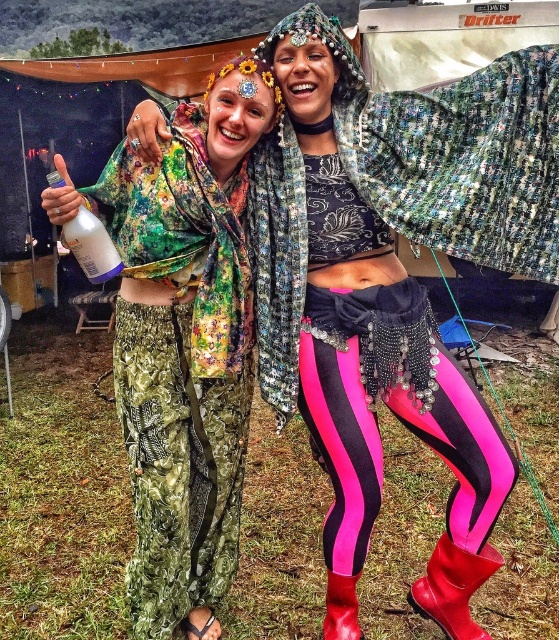
Between floral fabric pants at center and white plastic bottle at left, which one is positioned lower?

floral fabric pants at center

How much distance is there between floral fabric pants at center and white plastic bottle at left?

A distance of 50.78 centimeters exists between floral fabric pants at center and white plastic bottle at left.

Find the location of a particular element. Image resolution: width=559 pixels, height=640 pixels. floral fabric pants at center is located at coordinates (183, 342).

Does neon pink spandex leggings at center have a larger size compared to red rubber boot at lower right?

Indeed, neon pink spandex leggings at center has a larger size compared to red rubber boot at lower right.

Can you confirm if neon pink spandex leggings at center is smaller than red rubber boot at lower right?

Actually, neon pink spandex leggings at center might be larger than red rubber boot at lower right.

Which is behind, point (458, 465) or point (442, 580)?

The point (442, 580) is more distant.

The height and width of the screenshot is (640, 559). Find the location of `neon pink spandex leggings at center`. neon pink spandex leggings at center is located at coordinates (394, 413).

Is point (459, 577) positioned before point (79, 228)?

No, (459, 577) is behind (79, 228).

Is the position of red rubber boot at lower right less distant than that of white plastic bottle at left?

No, red rubber boot at lower right is further to the viewer.

The width and height of the screenshot is (559, 640). Find the location of `red rubber boot at lower right`. red rubber boot at lower right is located at coordinates (453, 588).

You are a GUI agent. You are given a task and a screenshot of the screen. Output one action in this format:
    pyautogui.click(x=<x>, y=<y>)
    Task: Click on the red rubber boot at lower right
    
    Given the screenshot: What is the action you would take?
    pyautogui.click(x=453, y=588)